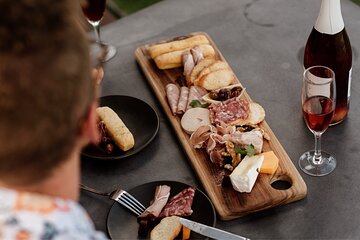
Locate an element on the screen. The image size is (360, 240). fork is located at coordinates (121, 194).